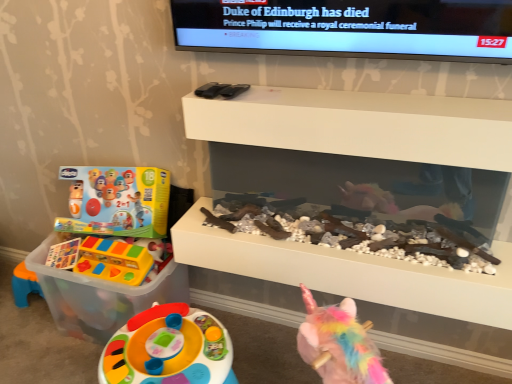
Question: Is white matte shelf at upper center, positioned as the 2th shelf in bottom-to-top order, not close to matte plastic toy at left, the first toy when ordered from top to bottom?

Choices:
 (A) no
 (B) yes

Answer: (A)

Question: Is white matte shelf at upper center, positioned as the 2th shelf in bottom-to-top order, smaller than matte plastic toy at left, the first toy when ordered from top to bottom?

Choices:
 (A) yes
 (B) no

Answer: (B)

Question: Is white matte shelf at upper center, the first shelf from the top, in front of matte plastic toy at left, the first toy when ordered from top to bottom?

Choices:
 (A) no
 (B) yes

Answer: (B)

Question: From the image's perspective, is white matte shelf at upper center, the first shelf from the top, located above matte plastic toy at left, the first toy when ordered from top to bottom?

Choices:
 (A) yes
 (B) no

Answer: (A)

Question: From a real-world perspective, does white matte shelf at upper center, positioned as the 2th shelf in bottom-to-top order, stand above matte plastic toy at left, the first toy when ordered from top to bottom?

Choices:
 (A) yes
 (B) no

Answer: (A)

Question: In terms of height, does white matte shelf at upper center, the first shelf from the top, look taller or shorter compared to white matte fireplace at center, the second shelf from the top?

Choices:
 (A) tall
 (B) short

Answer: (B)

Question: Is white matte shelf at upper center, positioned as the 2th shelf in bottom-to-top order, inside or outside of white matte fireplace at center, the second shelf from the top?

Choices:
 (A) outside
 (B) inside

Answer: (A)

Question: From the image's perspective, is white matte shelf at upper center, the first shelf from the top, located above or below white matte fireplace at center, the second shelf from the top?

Choices:
 (A) below
 (B) above

Answer: (B)

Question: In terms of width, does white matte shelf at upper center, the first shelf from the top, look wider or thinner when compared to white matte fireplace at center, marked as the first shelf in a bottom-to-top arrangement?

Choices:
 (A) thin
 (B) wide

Answer: (A)

Question: In the image, is translucent plastic toy at left, the first toy from the bottom, positioned in front of or behind matte plastic toy at left, the first toy when ordered from top to bottom?

Choices:
 (A) front
 (B) behind

Answer: (B)

Question: In terms of height, does translucent plastic toy at left, the second toy when ordered from top to bottom, look taller or shorter compared to matte plastic toy at left, the second toy ordered from the bottom?

Choices:
 (A) short
 (B) tall

Answer: (B)

Question: From a real-world perspective, is translucent plastic toy at left, the first toy from the bottom, above or below matte plastic toy at left, the first toy when ordered from top to bottom?

Choices:
 (A) above
 (B) below

Answer: (B)

Question: Is translucent plastic toy at left, the first toy from the bottom, inside or outside of matte plastic toy at left, the first toy when ordered from top to bottom?

Choices:
 (A) outside
 (B) inside

Answer: (A)

Question: Based on their positions, is white matte shelf at upper center, the first shelf from the top, located to the left or right of matte plastic toy at left, the first toy when ordered from top to bottom?

Choices:
 (A) left
 (B) right

Answer: (B)

Question: Is white matte shelf at upper center, the first shelf from the top, bigger or smaller than matte plastic toy at left, the first toy when ordered from top to bottom?

Choices:
 (A) big
 (B) small

Answer: (A)